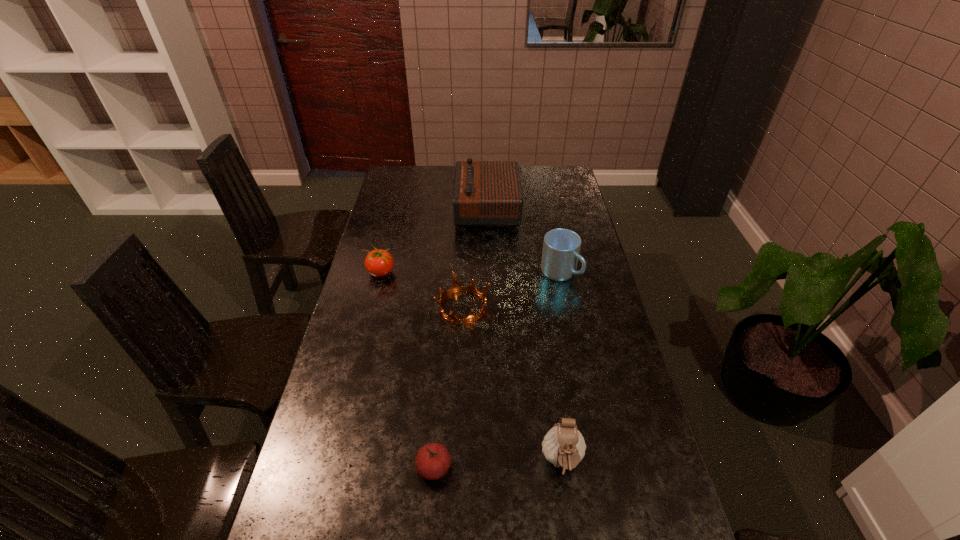
Locate an element on the screen. radio receiver is located at coordinates (486, 193).

Image resolution: width=960 pixels, height=540 pixels. Identify the location of the farthest object. (486, 193).

The image size is (960, 540). I want to click on mug, so click(x=561, y=247).

In order to click on pouch in this screenshot , I will do `click(564, 446)`.

Locate an element on the screen. This screenshot has height=540, width=960. the taller tomato is located at coordinates (379, 263).

This screenshot has height=540, width=960. What are the coordinates of `the left tomato` in the screenshot? It's located at (379, 263).

The width and height of the screenshot is (960, 540). I want to click on the shorter tomato, so click(433, 460).

The width and height of the screenshot is (960, 540). Find the location of `the right tomato`. the right tomato is located at coordinates (433, 460).

Identify the location of crown. The image size is (960, 540). (456, 287).

The image size is (960, 540). In order to click on blank space located 0.290m on the front panel of the tallest object in this screenshot , I will do `click(389, 209)`.